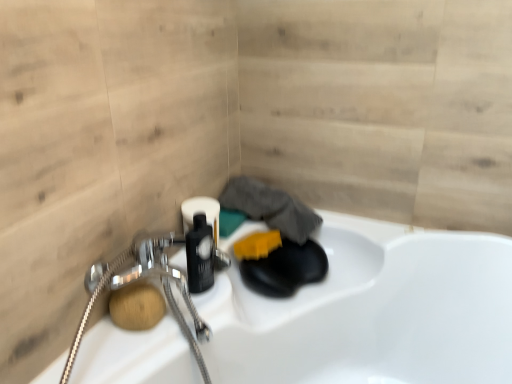
Question: Looking at the image, does yellow sponge at center, which is the 2th soap in left-to-right order, seem bigger or smaller compared to natural wood soap at lower left, which is the first soap from front to back?

Choices:
 (A) small
 (B) big

Answer: (B)

Question: Is yellow sponge at center, which is the 2th soap in left-to-right order, wider or thinner than natural wood soap at lower left, which is the 2th soap from right to left?

Choices:
 (A) wide
 (B) thin

Answer: (A)

Question: Is yellow sponge at center, the second soap from the bottom, to the left or to the right of natural wood soap at lower left, which is the first soap from front to back, in the image?

Choices:
 (A) right
 (B) left

Answer: (A)

Question: In terms of height, does natural wood soap at lower left, arranged as the 2th soap when viewed from the top, look taller or shorter compared to yellow sponge at center, marked as the second soap in a front-to-back arrangement?

Choices:
 (A) short
 (B) tall

Answer: (B)

Question: Is natural wood soap at lower left, the 1th soap in the left-to-right sequence, wider or thinner than yellow sponge at center, which is the 2th soap in left-to-right order?

Choices:
 (A) thin
 (B) wide

Answer: (A)

Question: Is natural wood soap at lower left, the 1th soap in the left-to-right sequence, situated inside yellow sponge at center, the second soap from the bottom, or outside?

Choices:
 (A) inside
 (B) outside

Answer: (B)

Question: Based on their positions, is natural wood soap at lower left, which is the first soap from front to back, located to the left or right of yellow sponge at center, marked as the second soap in a front-to-back arrangement?

Choices:
 (A) right
 (B) left

Answer: (B)